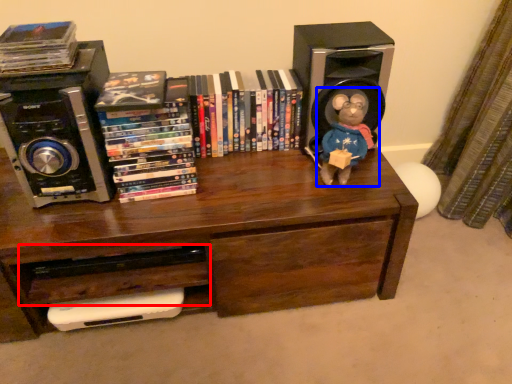
Question: Which object is further to the camera taking this photo, drawer (highlighted by a red box) or toy (highlighted by a blue box)?

Choices:
 (A) drawer
 (B) toy

Answer: (A)